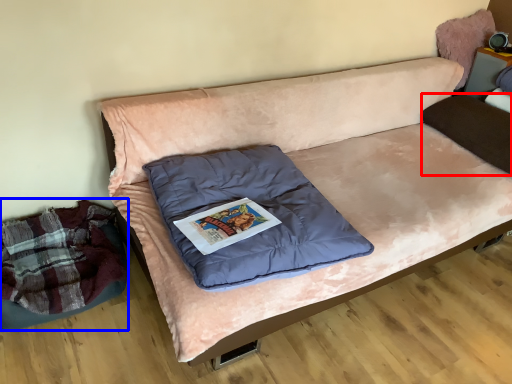
Question: Which object is further to the camera taking this photo, pillow (highlighted by a red box) or mattress (highlighted by a blue box)?

Choices:
 (A) pillow
 (B) mattress

Answer: (A)